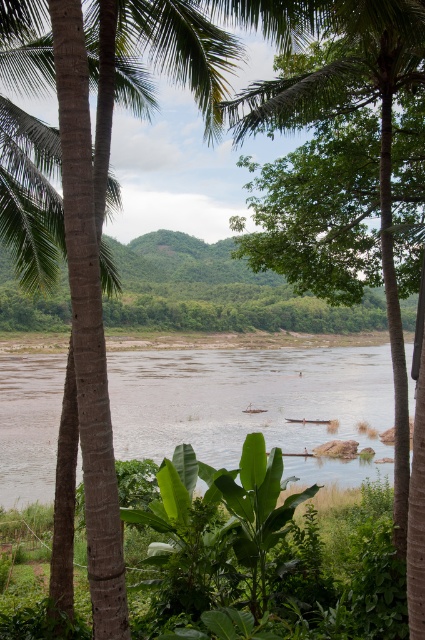
You are planning to cross the river using a small boat. The boat can only carry a maximum weight of 200 kg. You have to decide whether to dock at the brown muddy water at center or the green textured palm tree at left. Which location allows the boat to dock safely without getting stuck due to narrowness?

The brown muddy water at center is wider than the green textured palm tree at left, so docking at the brown muddy water at center would be safer as it provides enough space for the boat to maneuver without getting stuck.

You are standing at the riverbank and see the green leafy palm tree at center and the green textured palm tree at left. Which palm tree is positioned closer to your left side?

The green textured palm tree at left is closer to your left side because it is positioned to the left of the green leafy palm tree at center.